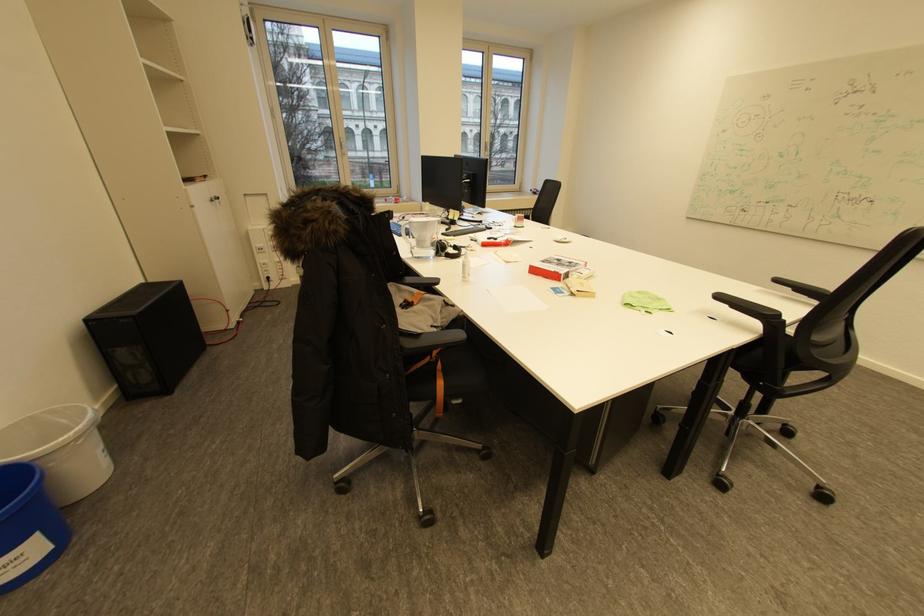
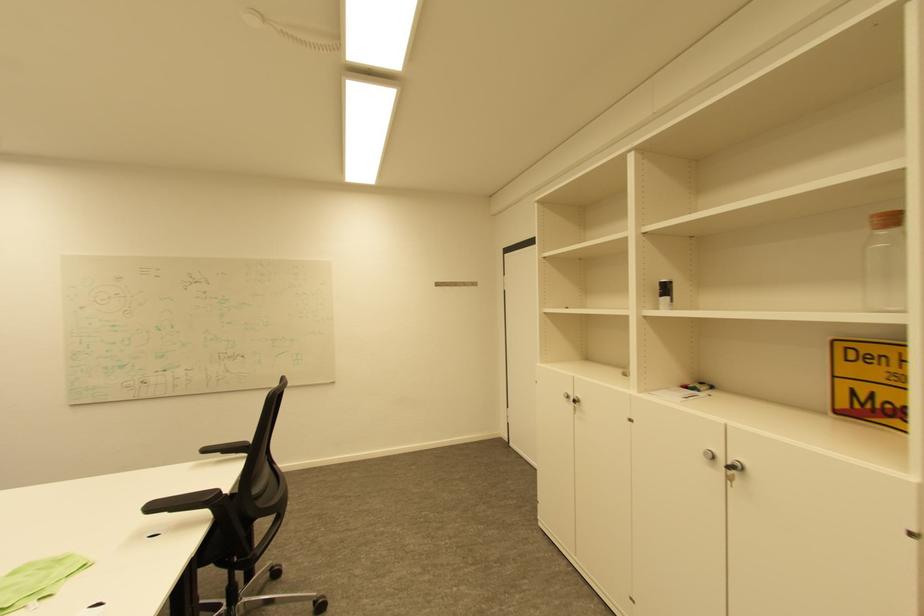
In the second image, find the point that corresponds to point (725, 297) in the first image.

(159, 508)